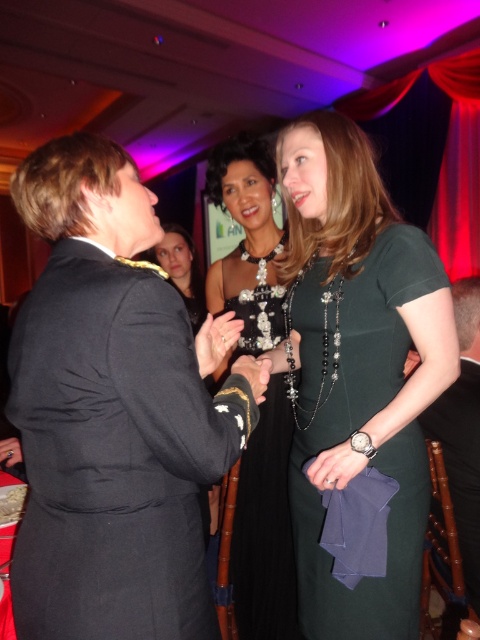
Question: Which object is the farthest from the dark brown hair at center?

Choices:
 (A) black satin dress at center
 (B) black fabric suit at left

Answer: (B)

Question: Which object is closer to the camera taking this photo?

Choices:
 (A) dark green dress at center
 (B) dark brown hair at center
 (C) black fabric suit at left
 (D) black satin dress at center

Answer: (C)

Question: Can you confirm if dark green dress at center is positioned to the left of black satin dress at center?

Choices:
 (A) yes
 (B) no

Answer: (B)

Question: Considering the relative positions of black fabric suit at left and dark brown hair at center in the image provided, where is black fabric suit at left located with respect to dark brown hair at center?

Choices:
 (A) above
 (B) below

Answer: (B)

Question: Where is black satin dress at center located in relation to dark brown hair at center in the image?

Choices:
 (A) right
 (B) left

Answer: (A)

Question: Which object appears farthest from the camera in this image?

Choices:
 (A) black satin dress at center
 (B) dark brown hair at center
 (C) black fabric dress at center

Answer: (B)